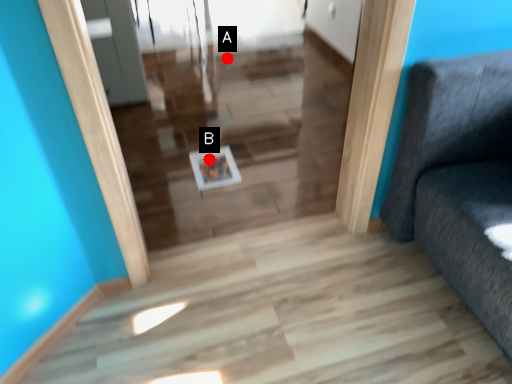
Question: Two points are circled on the image, labeled by A and B beside each circle. Which of the following is the farthest from the observer?

Choices:
 (A) A is further
 (B) B is further

Answer: (A)